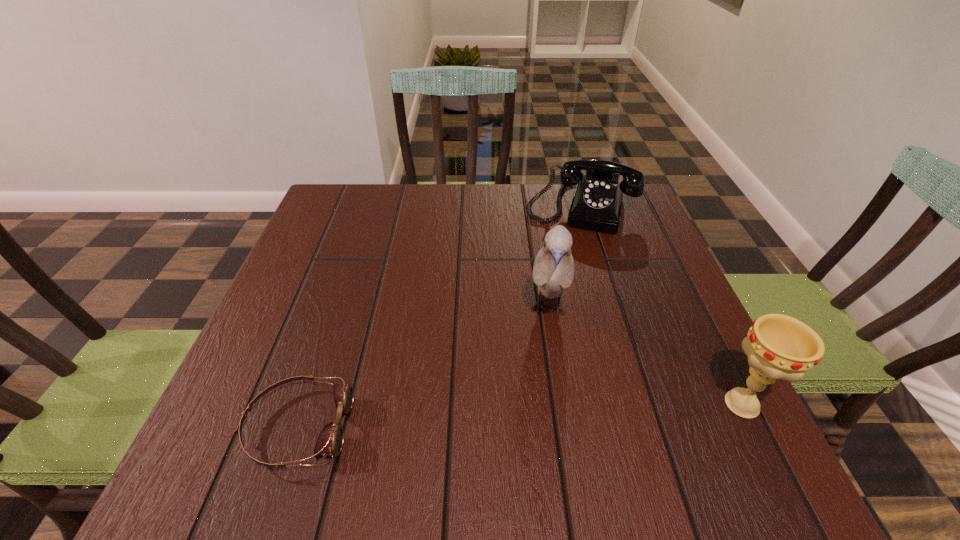
Where is `vacant space on the desktop that is between the shortest object and the third shortest object and is positioned at the beak of the tallest object`? vacant space on the desktop that is between the shortest object and the third shortest object and is positioned at the beak of the tallest object is located at coordinates (538, 415).

You are a GUI agent. You are given a task and a screenshot of the screen. Output one action in this format:
    pyautogui.click(x=<x>, y=<y>)
    Task: Click on the free space on the desktop that is between the leftmost object and the chalice and is positioned on the dial of the telephone
    The image size is (960, 540).
    Given the screenshot: What is the action you would take?
    pyautogui.click(x=527, y=416)